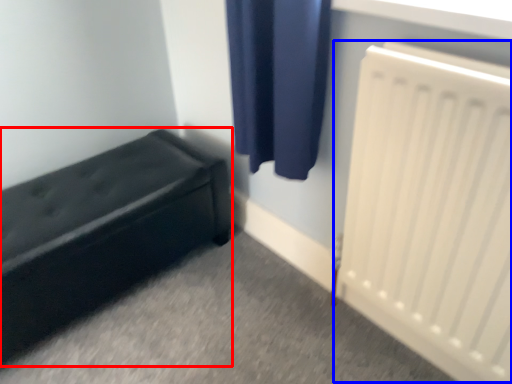
Question: Which point is closer to the camera, furniture (highlighted by a red box) or radiator (highlighted by a blue box)?

Choices:
 (A) furniture
 (B) radiator

Answer: (B)